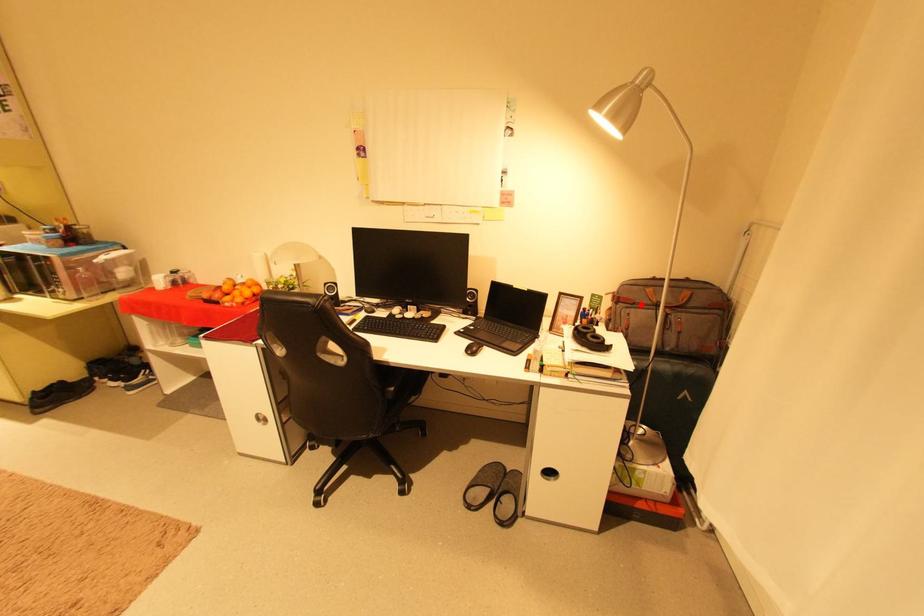
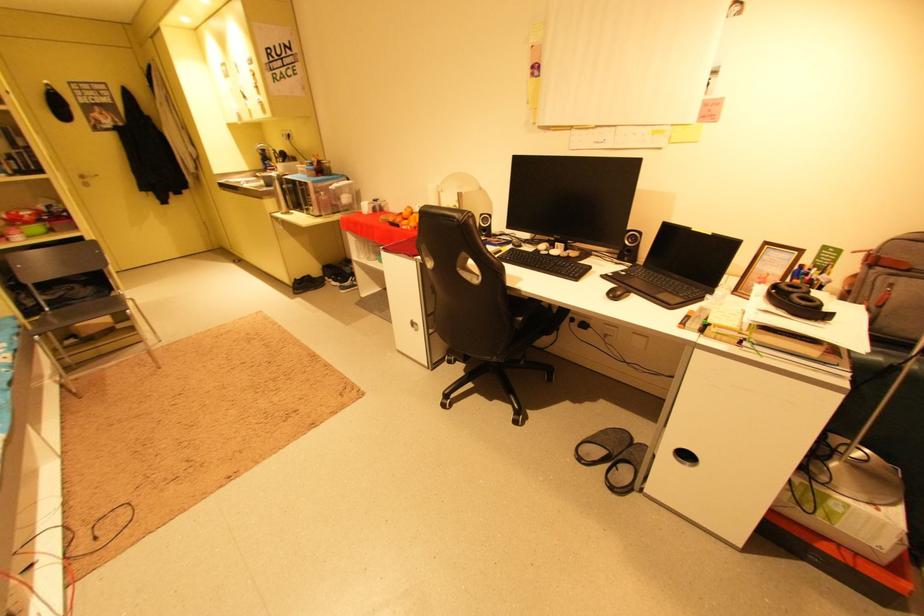
Question: I am providing you with two images of the same scene from different viewpoints. Image1 has a red point marked. In image2, the corresponding 3D location appears at what relative position? Reply with the corresponding letter.

Choices:
 (A) Closer
 (B) Farther

Answer: (B)